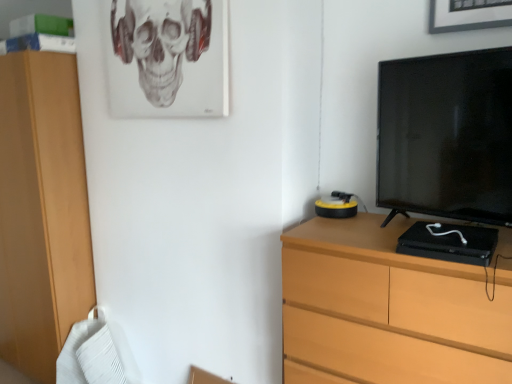
Question: Does wooden chest of drawers at right have a greater width compared to black glossy television at right?

Choices:
 (A) no
 (B) yes

Answer: (B)

Question: Can you see wooden chest of drawers at right touching black glossy television at right?

Choices:
 (A) no
 (B) yes

Answer: (A)

Question: Would you say black glossy television at right is part of wooden chest of drawers at right's contents?

Choices:
 (A) no
 (B) yes

Answer: (A)

Question: Could you tell me if wooden chest of drawers at right is turned towards black glossy television at right?

Choices:
 (A) yes
 (B) no

Answer: (B)

Question: Can you confirm if wooden chest of drawers at right is positioned to the left of black glossy television at right?

Choices:
 (A) yes
 (B) no

Answer: (A)

Question: Looking at their shapes, would you say wooden chest of drawers at right is wider or thinner than gray matte skull at upper center?

Choices:
 (A) wide
 (B) thin

Answer: (A)

Question: Considering the positions of wooden chest of drawers at right and gray matte skull at upper center in the image, is wooden chest of drawers at right taller or shorter than gray matte skull at upper center?

Choices:
 (A) short
 (B) tall

Answer: (B)

Question: Would you say wooden chest of drawers at right is inside or outside gray matte skull at upper center?

Choices:
 (A) outside
 (B) inside

Answer: (A)

Question: Is wooden chest of drawers at right bigger or smaller than gray matte skull at upper center?

Choices:
 (A) big
 (B) small

Answer: (A)

Question: From a real-world perspective, is black glossy television at right physically located above or below gray matte skull at upper center?

Choices:
 (A) above
 (B) below

Answer: (B)

Question: Considering the positions of point (376, 153) and point (157, 69), is point (376, 153) closer or farther from the camera than point (157, 69)?

Choices:
 (A) farther
 (B) closer

Answer: (B)

Question: From the image's perspective, relative to gray matte skull at upper center, is black glossy television at right above or below?

Choices:
 (A) above
 (B) below

Answer: (B)

Question: In terms of size, does black glossy television at right appear bigger or smaller than gray matte skull at upper center?

Choices:
 (A) big
 (B) small

Answer: (A)

Question: Relative to black glossy television at right, is gray matte skull at upper center in front or behind?

Choices:
 (A) front
 (B) behind

Answer: (B)

Question: Considering the positions of point (209, 1) and point (455, 74), is point (209, 1) closer or farther from the camera than point (455, 74)?

Choices:
 (A) farther
 (B) closer

Answer: (A)